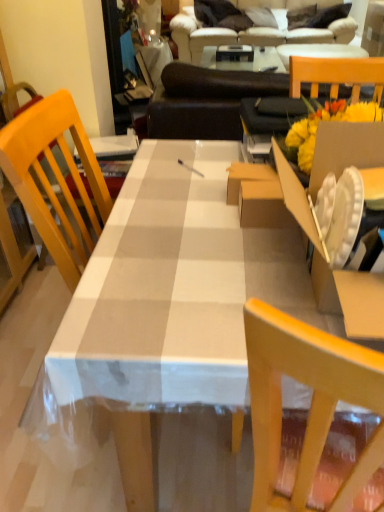
Question: Considering the relative positions of wooden chair at right and white checkered tablecloth at center in the image provided, is wooden chair at right behind white checkered tablecloth at center?

Choices:
 (A) yes
 (B) no

Answer: (A)

Question: Is wooden chair at right not close to white checkered tablecloth at center?

Choices:
 (A) yes
 (B) no

Answer: (B)

Question: From the image's perspective, does wooden chair at right appear lower than white checkered tablecloth at center?

Choices:
 (A) yes
 (B) no

Answer: (B)

Question: From a real-world perspective, is wooden chair at right located higher than white checkered tablecloth at center?

Choices:
 (A) no
 (B) yes

Answer: (B)

Question: Is wooden chair at right positioned before white checkered tablecloth at center?

Choices:
 (A) no
 (B) yes

Answer: (A)

Question: Does wooden chair at right have a lesser width compared to white checkered tablecloth at center?

Choices:
 (A) no
 (B) yes

Answer: (B)

Question: Does beige fabric couch at upper center have a lesser height compared to white checkered tablecloth at center?

Choices:
 (A) yes
 (B) no

Answer: (B)

Question: From a real-world perspective, is beige fabric couch at upper center physically below white checkered tablecloth at center?

Choices:
 (A) no
 (B) yes

Answer: (A)

Question: Is beige fabric couch at upper center to the left of white checkered tablecloth at center from the viewer's perspective?

Choices:
 (A) yes
 (B) no

Answer: (B)

Question: From a real-world perspective, is beige fabric couch at upper center on top of white checkered tablecloth at center?

Choices:
 (A) yes
 (B) no

Answer: (A)

Question: Is beige fabric couch at upper center wider than white checkered tablecloth at center?

Choices:
 (A) no
 (B) yes

Answer: (A)

Question: Can we say beige fabric couch at upper center lies outside white checkered tablecloth at center?

Choices:
 (A) no
 (B) yes

Answer: (B)

Question: Is white checkered tablecloth at center shorter than wooden chair at right?

Choices:
 (A) no
 (B) yes

Answer: (A)